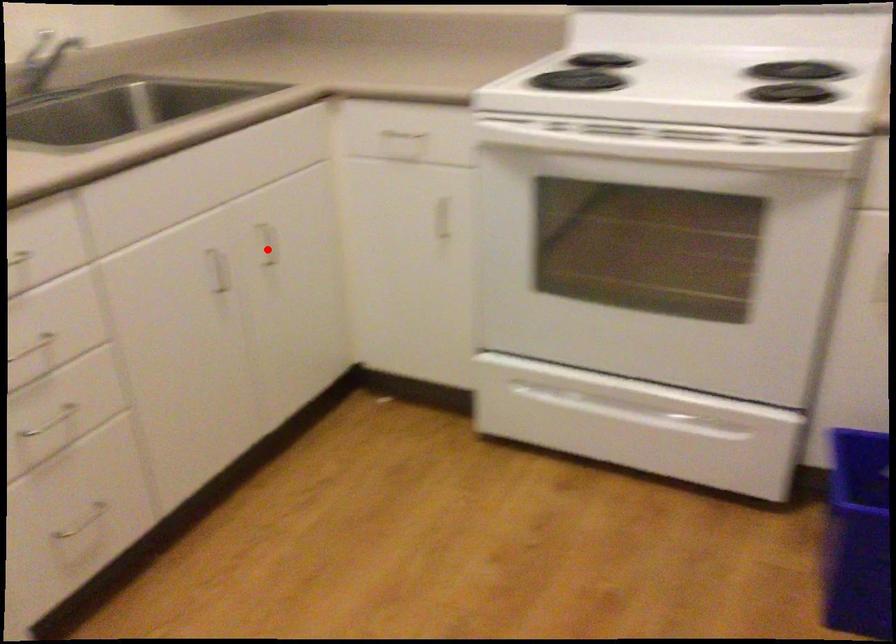
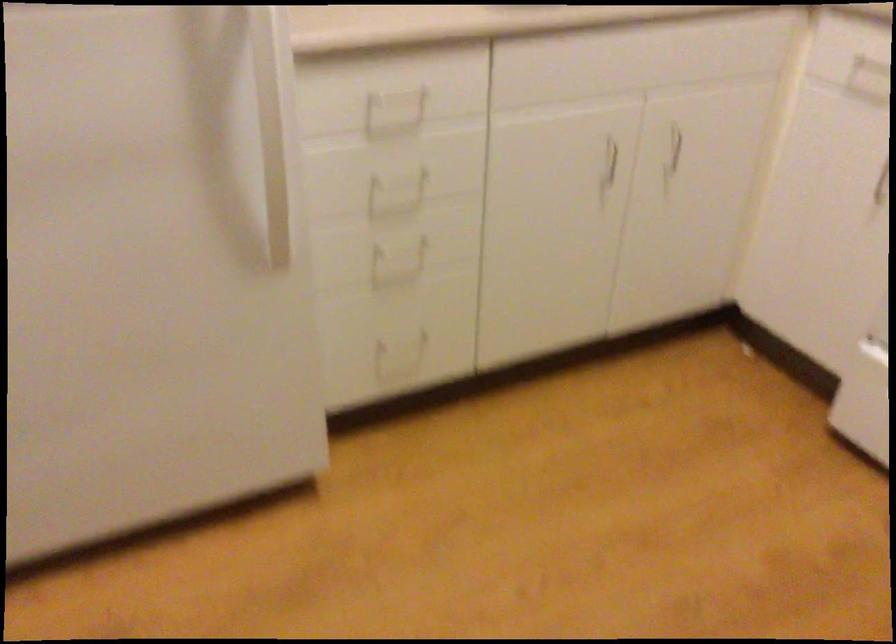
In the second image, find the point that corresponds to the highlighted location in the first image.

(675, 147)